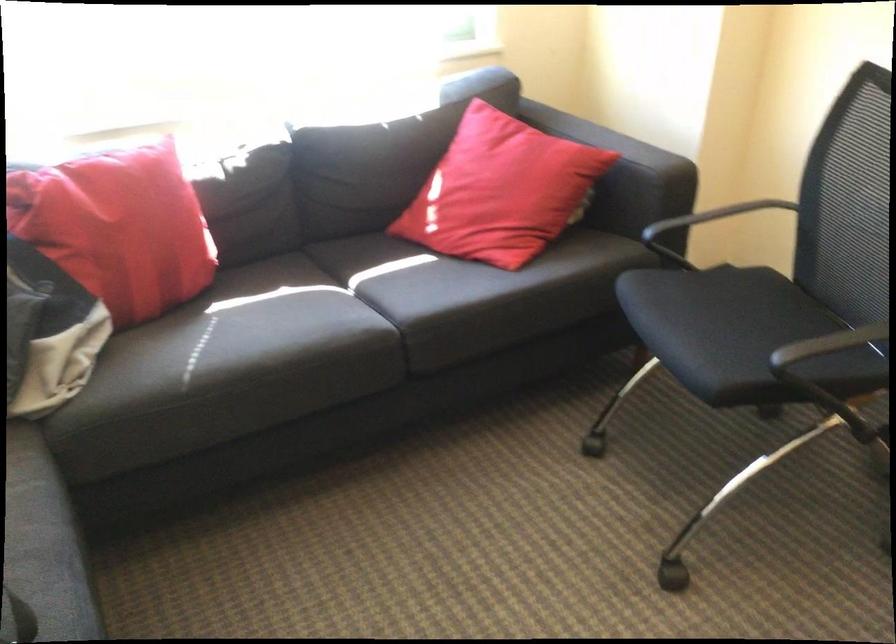
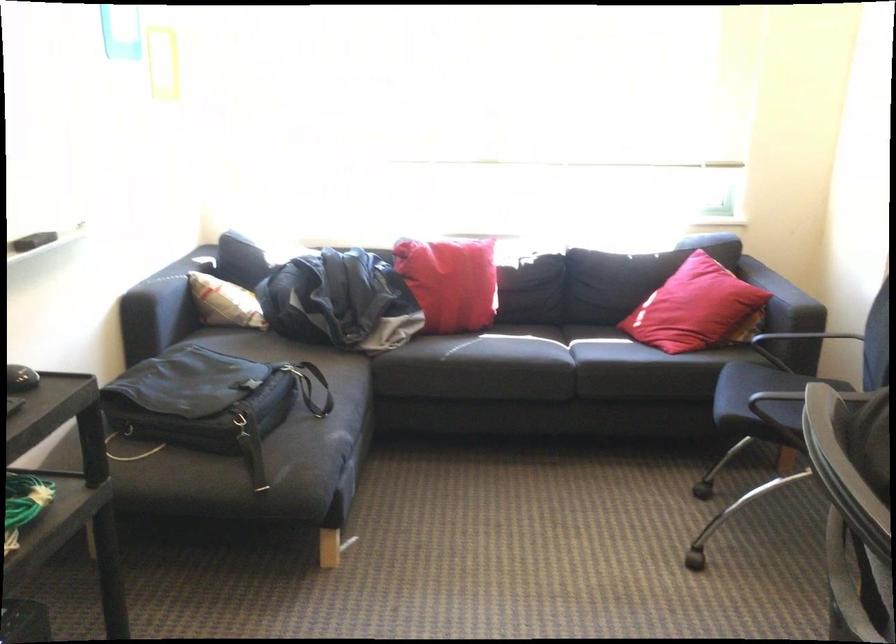
Find the pixel in the second image that matches pixel 624 164 in the first image.

(782, 298)